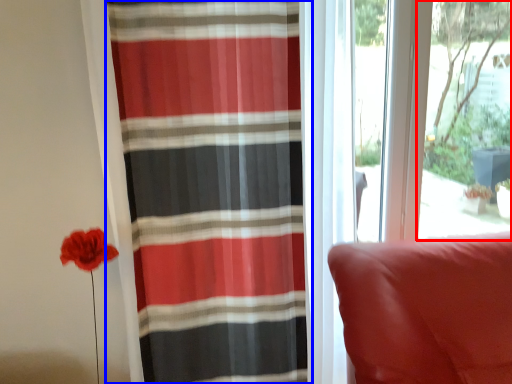
Question: Among these objects, which one is nearest to the camera, window screen (highlighted by a red box) or curtain (highlighted by a blue box)?

Choices:
 (A) window screen
 (B) curtain

Answer: (B)